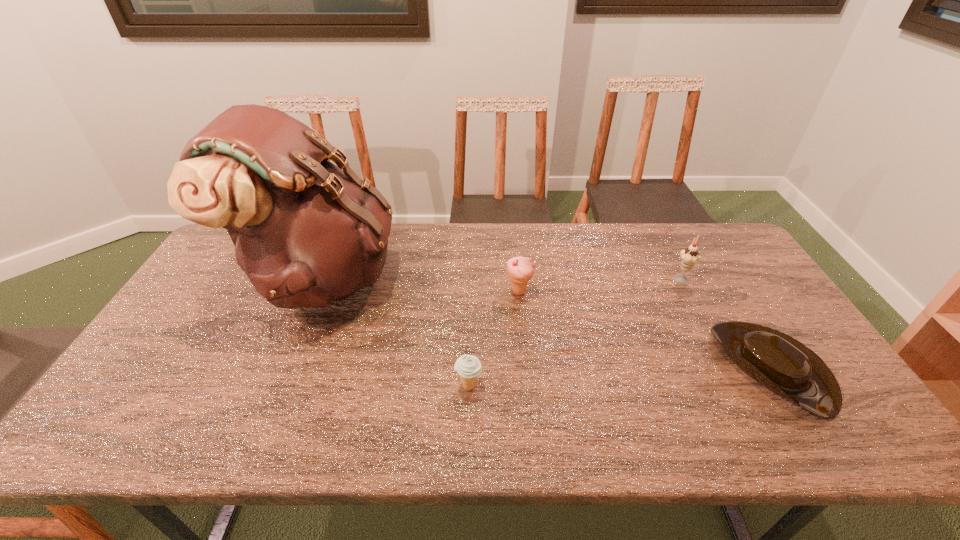
Identify the location of blank area located on the left of the leftmost icecream. [431, 386].

Locate an element on the screen. This screenshot has height=540, width=960. vacant space located 0.320m on the left of the cowboy hat is located at coordinates (594, 368).

Identify the location of object that is at the far edge. (306, 232).

You are a GUI agent. You are given a task and a screenshot of the screen. Output one action in this format:
    pyautogui.click(x=<x>, y=<y>)
    Task: Click on the object located in the near edge section of the desktop
    
    Given the screenshot: What is the action you would take?
    pyautogui.click(x=785, y=366)

Locate an element on the screen. This screenshot has width=960, height=540. object at the left edge is located at coordinates (306, 232).

I want to click on object positioned at the right edge, so click(x=785, y=366).

At what (x,y) coordinates should I click in order to perform the action: click on object that is positioned at the far left corner. Please return your answer as a coordinate pair (x, y). Looking at the image, I should click on (306, 232).

This screenshot has width=960, height=540. I want to click on object located at the near right corner, so click(785, 366).

In the image, there is a desktop. Identify the location of free space at the far edge. (663, 241).

This screenshot has height=540, width=960. What are the coordinates of `vacant region at the near edge of the desktop` in the screenshot? It's located at (803, 447).